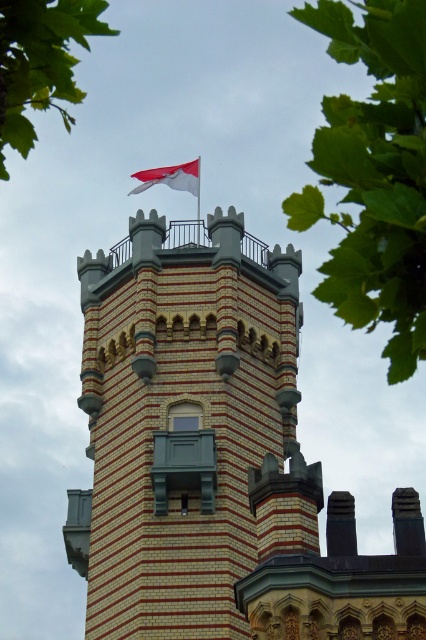
Which of these two, brick tower at center or green leafy tree at upper center, stands shorter?

brick tower at center

Where is `brick tower at center`? brick tower at center is located at coordinates (187, 428).

Between point (103, 451) and point (319, 193), which one is positioned in front?

Point (319, 193)

The width and height of the screenshot is (426, 640). Find the location of `brick tower at center`. brick tower at center is located at coordinates (187, 428).

Who is more forward, (19, 35) or (173, 180)?

Point (19, 35) is more forward.

Consider the image. Between green leafy tree at upper left and white fabric flag at top, which one has less height?

Standing shorter between the two is white fabric flag at top.

Describe the element at coordinates (40, 61) in the screenshot. I see `green leafy tree at upper left` at that location.

At what (x,y) coordinates should I click in order to perform the action: click on green leafy tree at upper left. Please return your answer as a coordinate pair (x, y). The image size is (426, 640). Looking at the image, I should click on (40, 61).

Consider the image. Between brick tower at center and white fabric flag at top, which one appears on the right side from the viewer's perspective?

From the viewer's perspective, brick tower at center appears more on the right side.

Can you confirm if brick tower at center is positioned to the right of white fabric flag at top?

Yes, brick tower at center is to the right of white fabric flag at top.

Which is in front, point (282, 390) or point (184, 177)?

Positioned in front is point (282, 390).

The height and width of the screenshot is (640, 426). I want to click on brick tower at center, so click(187, 428).